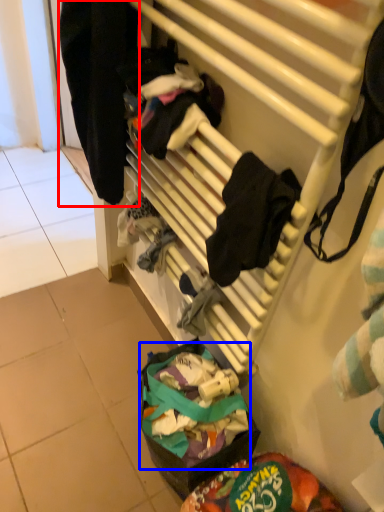
Question: Which point is further to the camera, clothing (highlighted by a red box) or food (highlighted by a blue box)?

Choices:
 (A) clothing
 (B) food

Answer: (B)